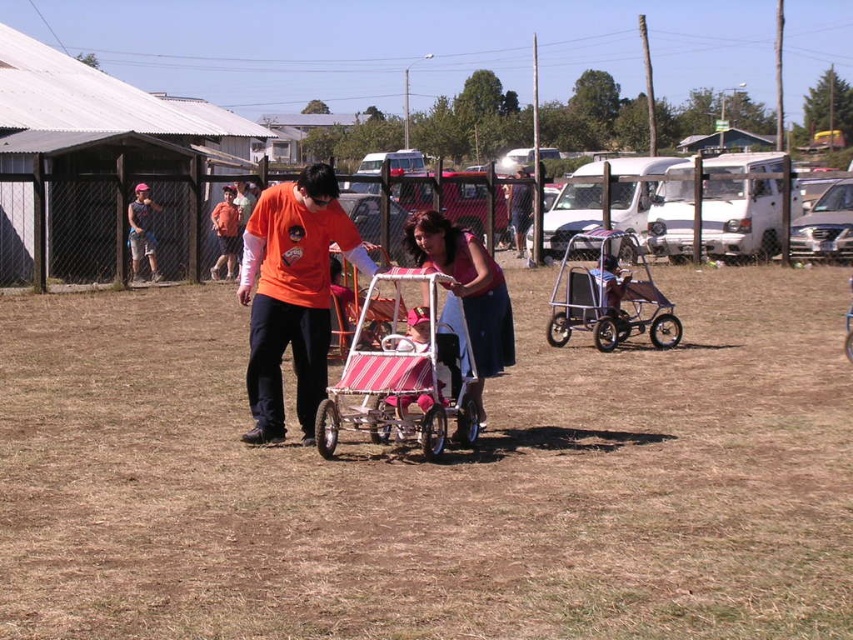
Which is more to the right, orange matte shirt at center or striped fabric stroller at center?

From the viewer's perspective, striped fabric stroller at center appears more on the right side.

Based on the photo, does orange matte shirt at center have a smaller size compared to striped fabric stroller at center?

Correct, orange matte shirt at center occupies less space than striped fabric stroller at center.

Who is more distant from viewer, (289, 273) or (431, 320)?

The point (289, 273) is behind.

At what (x,y) coordinates should I click in order to perform the action: click on orange matte shirt at center. Please return your answer as a coordinate pair (x, y). Image resolution: width=853 pixels, height=640 pixels. Looking at the image, I should click on (292, 294).

Can you confirm if orange matte shirt at center is thinner than pink fabric stroller at center?

In fact, orange matte shirt at center might be wider than pink fabric stroller at center.

Can you confirm if orange matte shirt at center is positioned below pink fabric stroller at center?

No.

Is point (320, 401) positioned after point (473, 280)?

That is False.

Where is `orange matte shirt at center`? orange matte shirt at center is located at coordinates 292,294.

Does striped fabric stroller at center appear on the left side of pink fabric stroller at center?

Yes, striped fabric stroller at center is to the left of pink fabric stroller at center.

The height and width of the screenshot is (640, 853). In order to click on striped fabric stroller at center in this screenshot , I will do `click(405, 374)`.

Between point (405, 380) and point (476, 317), which one is positioned in front?

Point (405, 380) is more forward.

At what (x,y) coordinates should I click in order to perform the action: click on striped fabric stroller at center. Please return your answer as a coordinate pair (x, y). This screenshot has width=853, height=640. Looking at the image, I should click on (405, 374).